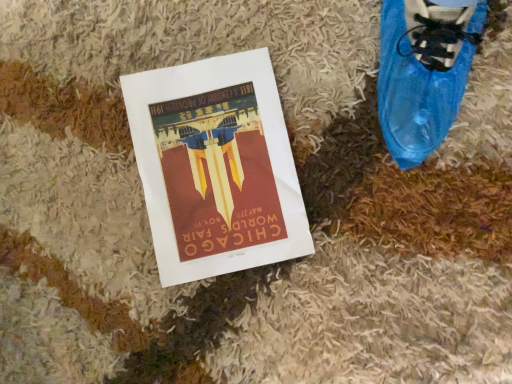
Find the location of `empty space that is ontop of matte paper poster at center (from a real-world perspective)`. empty space that is ontop of matte paper poster at center (from a real-world perspective) is located at coordinates (209, 156).